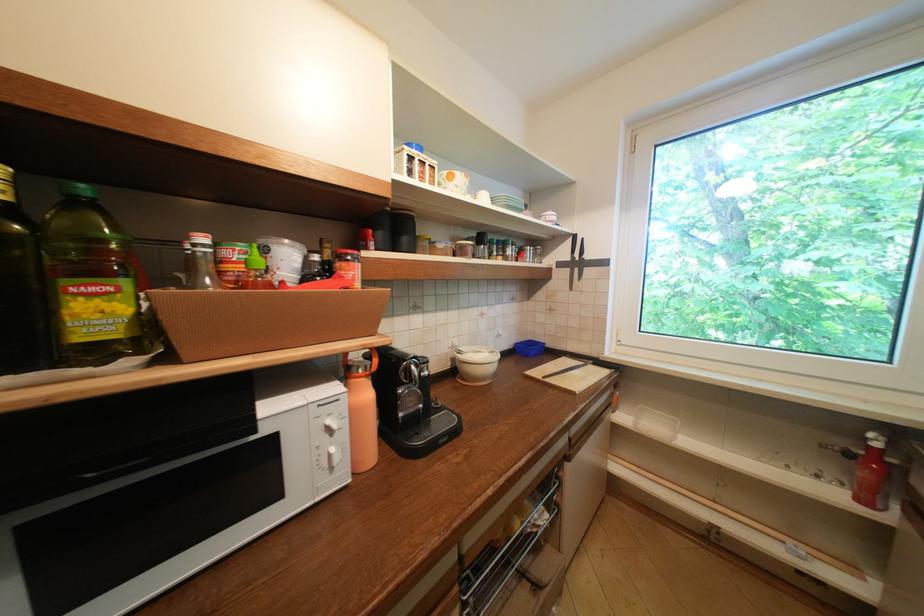
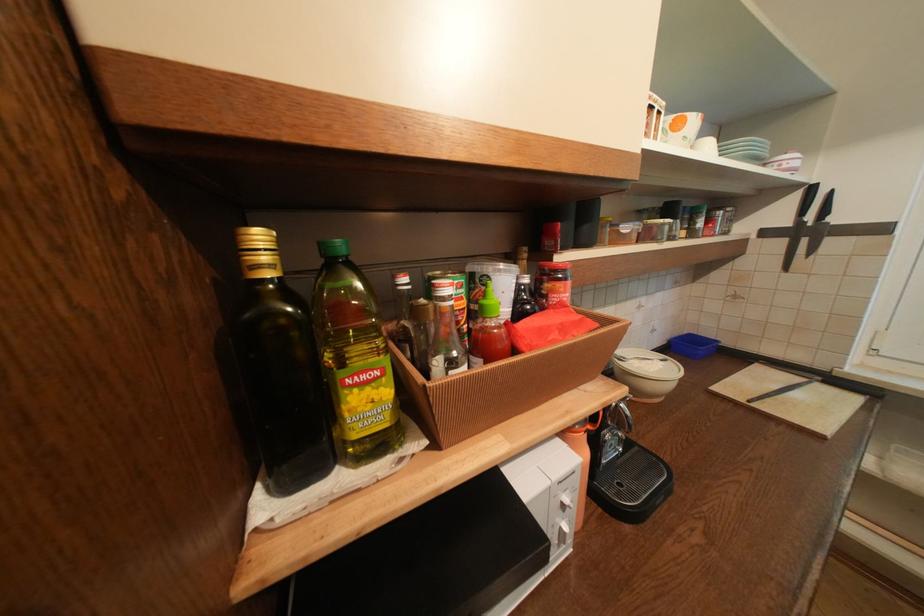
Where in the second image is the point corresponding to (497,355) from the first image?

(670, 363)